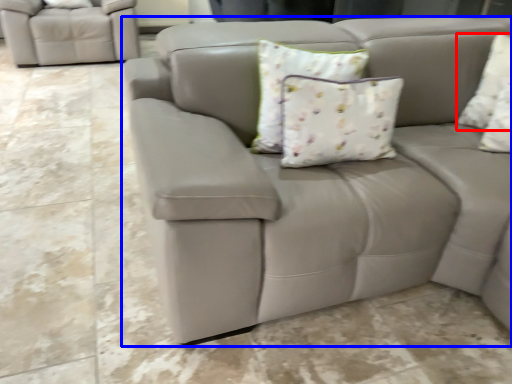
Question: Which point is further to the camera, pillow (highlighted by a red box) or studio couch (highlighted by a blue box)?

Choices:
 (A) pillow
 (B) studio couch

Answer: (A)